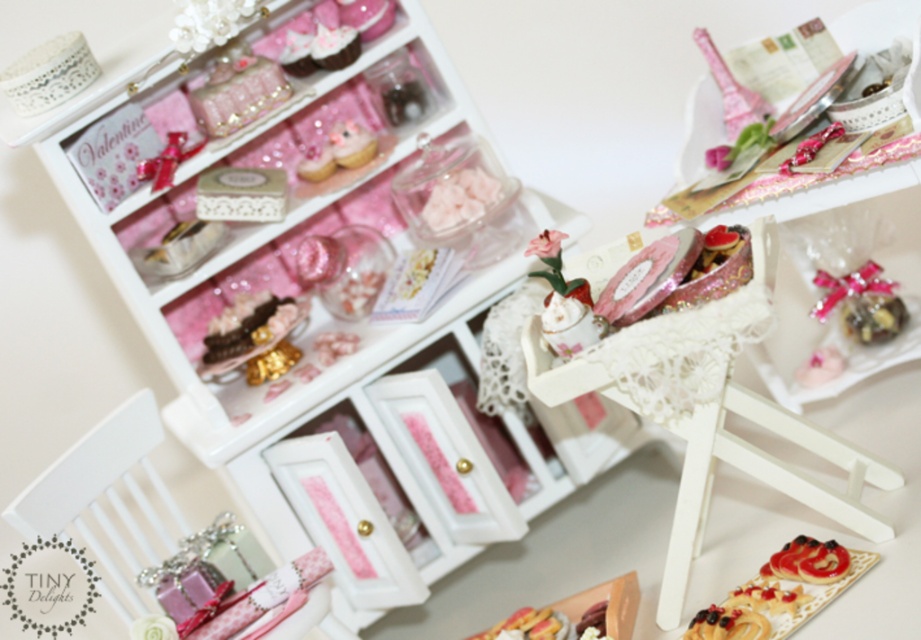
You are a jeweler examining the shiny gold necklace at upper left and the glazed pastry at center in the Valentine display. Which object is wider?

The shiny gold necklace at upper left is wider than the glazed pastry at center.

You are standing 2 meters away from the Valentine display. There is a point at coordinates point [213,353]. Can you reach that point without moving closer?

The distance of point [213,353] is 1.71 meters from the viewer. Since you are standing 2 meters away, you can reach it without moving closer because it is within your current distance range.

You are standing in front of the Valentine display and want to touch both points marked in the image. Which point, point (239, 58) or point (280, 316), will require you to reach further out to touch it?

Point (280, 316) requires reaching further because it is farther from the viewer compared to point (239, 58).